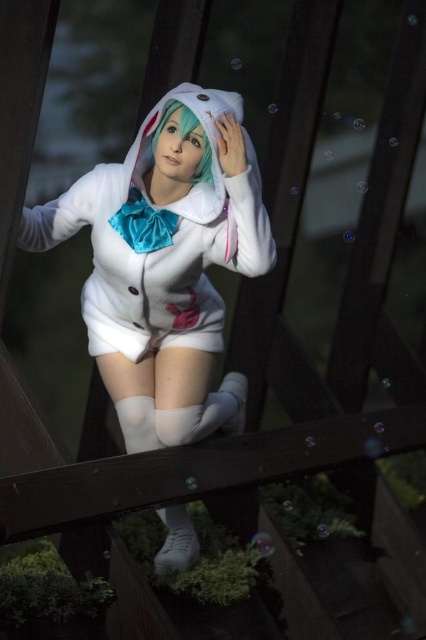
You are a photographer trying to capture the perfect shot of the person in the bunny costume. You notice the white fabric at center and the green matte hair at center. Which of these two elements should you focus on if you want to highlight the larger feature in your photo?

The white fabric at center has a larger size compared to the green matte hair at center, so focusing on the white fabric at center would highlight the larger feature in the photo.

You are a photographer setting up for a photoshoot. You notice the white plush bunny costume at center and the green matte hair at center in the scene. Which object should you focus on if you want to highlight the taller one?

The white plush bunny costume at center is taller than the green matte hair at center, so you should focus on the white plush bunny costume at center to highlight the taller one.